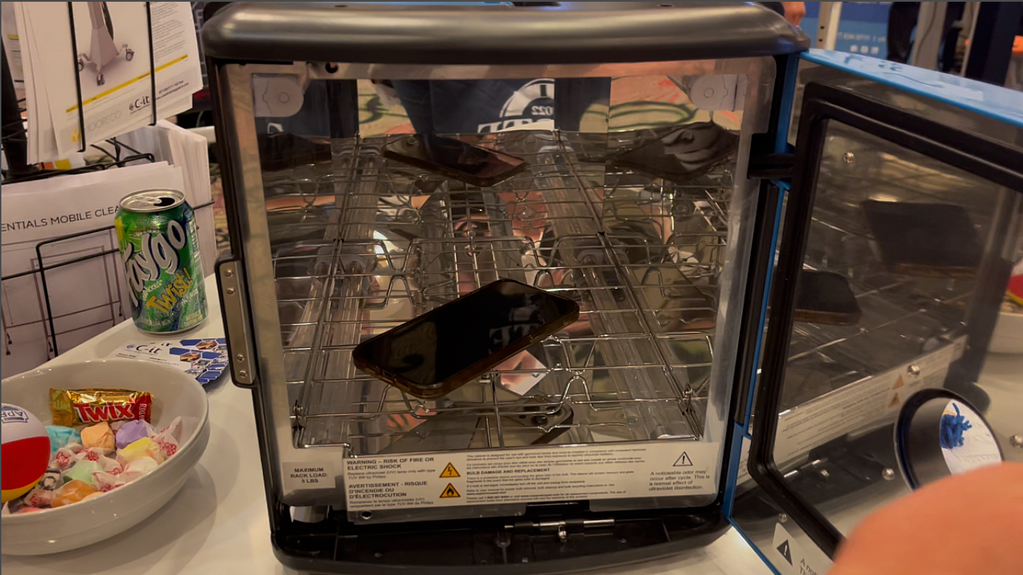
Image resolution: width=1023 pixels, height=575 pixels. Identify the location of bowl. (136, 496).